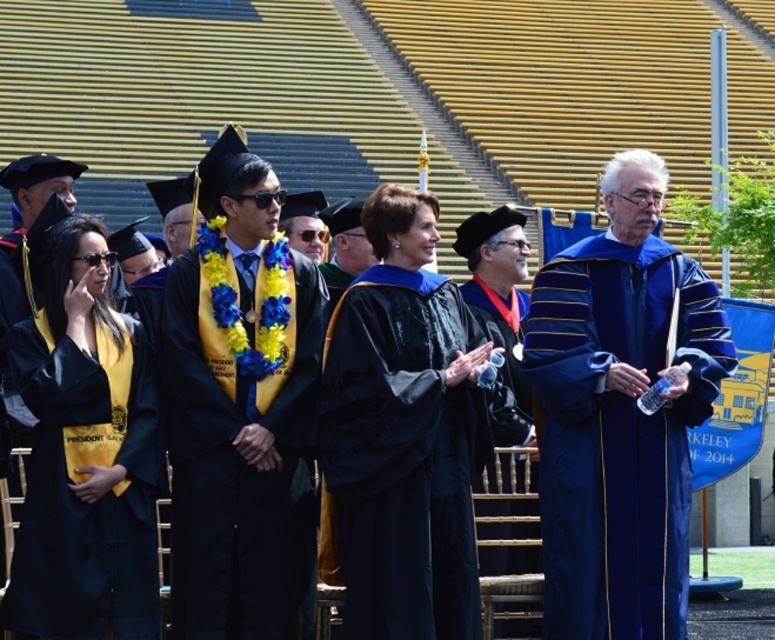
Question: Which point appears farthest from the camera in this image?

Choices:
 (A) (129, 532)
 (B) (302, 458)
 (C) (584, 332)
 (D) (377, 524)

Answer: (C)

Question: Which object appears farthest from the camera in this image?

Choices:
 (A) matte black graduation gown at center
 (B) matte black robe at center
 (C) matte black gown at left
 (D) blue velvet gown at center

Answer: (A)

Question: Does matte black graduation gown at center appear on the right side of matte black gown at left?

Choices:
 (A) yes
 (B) no

Answer: (A)

Question: Is matte black robe at center to the right of matte black graduation gown at center from the viewer's perspective?

Choices:
 (A) yes
 (B) no

Answer: (A)

Question: Is blue velvet gown at center below matte black gown at left?

Choices:
 (A) yes
 (B) no

Answer: (B)

Question: Which point is farther from the camera taking this photo?

Choices:
 (A) (474, 420)
 (B) (577, 371)

Answer: (A)